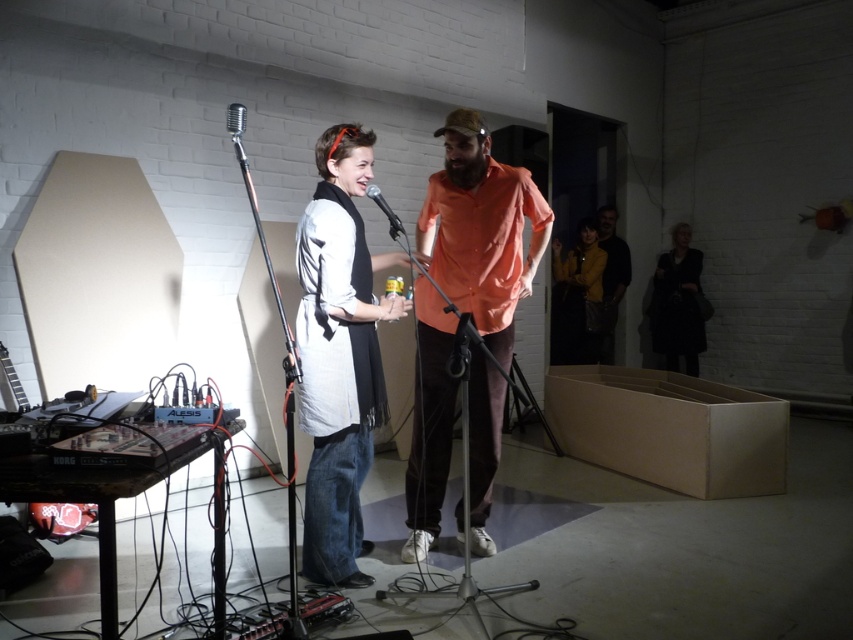
Question: Considering the real-world distances, which object is farthest from the silver metallic microphone at upper center?

Choices:
 (A) white cotton shirt at center
 (B) black leather jacket at right
 (C) metallic silver microphone at center

Answer: (B)

Question: Based on their relative distances, which object is farther from the orange cotton shirt at center?

Choices:
 (A) black leather jacket at right
 (B) yellow-orange shirt at center

Answer: (A)

Question: Does white cotton shirt at center have a greater width compared to silver metallic microphone at upper center?

Choices:
 (A) no
 (B) yes

Answer: (B)

Question: Can you confirm if yellow-orange shirt at center is positioned to the left of metallic silver microphone at center?

Choices:
 (A) yes
 (B) no

Answer: (B)

Question: Which is nearer to the orange cotton shirt at center?

Choices:
 (A) metallic silver microphone at center
 (B) white cotton shirt at center
 (C) yellow leather jacket at center

Answer: (B)

Question: Is white cotton shirt at center to the right of silver metallic microphone at upper center from the viewer's perspective?

Choices:
 (A) no
 (B) yes

Answer: (B)